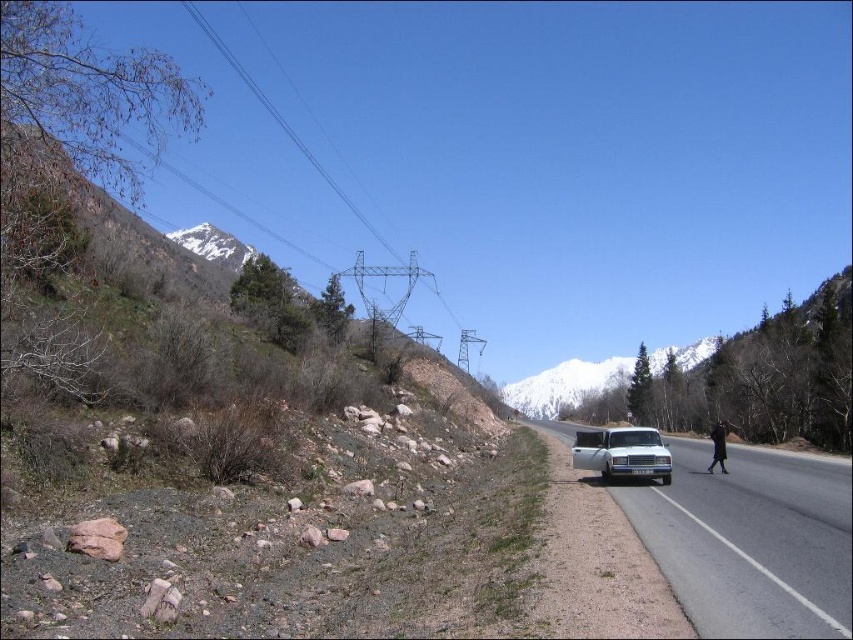
You are standing at the point marked by the coordinates point (618, 502) in the image. You want to walk to the white van parked on the right side of the road. How far will you have to walk to reach the van?

The distance between you and the white van parked on the right side of the road is 373.04 feet.